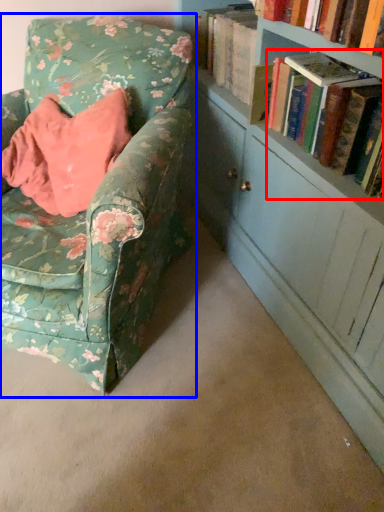
Question: Which of the following is the closest to the observer, book (highlighted by a red box) or chair (highlighted by a blue box)?

Choices:
 (A) book
 (B) chair

Answer: (B)